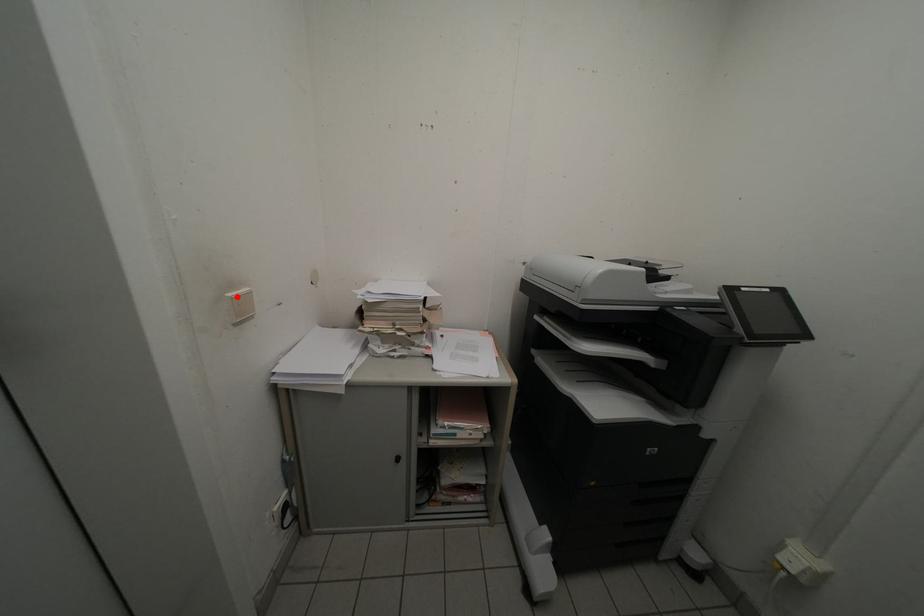
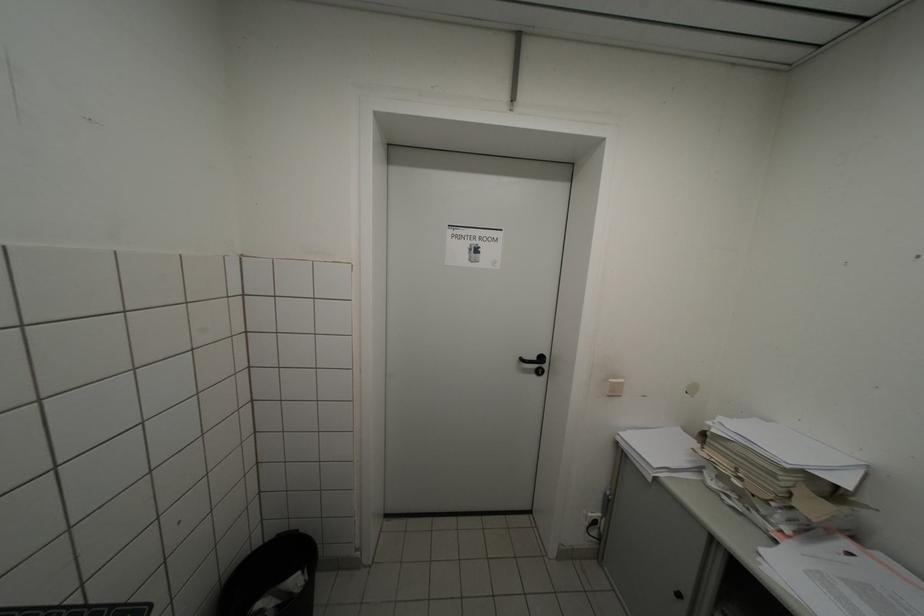
Find the pixel in the second image that matches the highlighted location in the first image.

(618, 383)